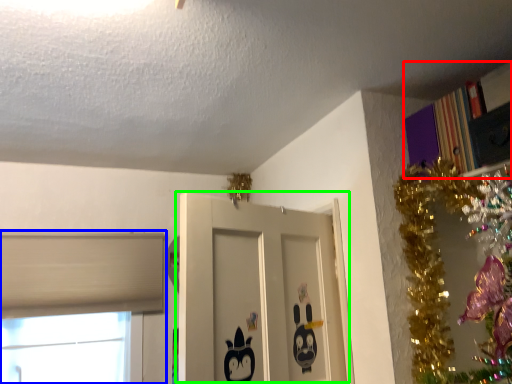
Question: Based on their relative distances, which object is nearer to bookcase (highlighted by a red box)? Choose from window (highlighted by a blue box) and door (highlighted by a green box).

Choices:
 (A) window
 (B) door

Answer: (B)